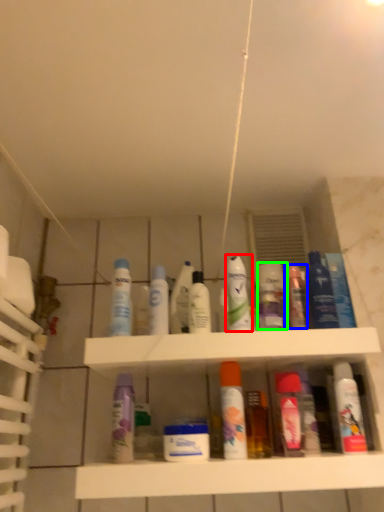
Question: Estimate the real-world distances between objects in this image. Which object is closer to mouthwash (highlighted by a red box), toiletry (highlighted by a blue box) or toiletry (highlighted by a green box)?

Choices:
 (A) toiletry
 (B) toiletry

Answer: (B)